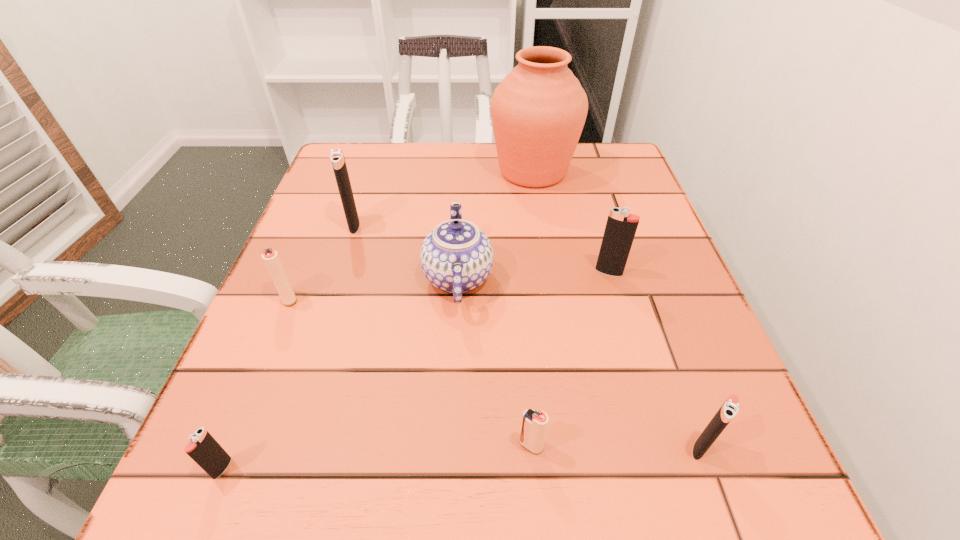
In the image, there is a desktop. Where is `vacant space at the left edge`? The image size is (960, 540). vacant space at the left edge is located at coordinates tap(247, 363).

In order to click on vacant space at the right edge in this screenshot , I will do `click(642, 208)`.

The height and width of the screenshot is (540, 960). In order to click on vacant area at the far left corner in this screenshot , I will do `click(373, 156)`.

This screenshot has width=960, height=540. What are the coordinates of `vacant space at the far right corner of the desktop` in the screenshot? It's located at coord(605,166).

The width and height of the screenshot is (960, 540). Find the location of `vacant space at the near right corner of the desktop`. vacant space at the near right corner of the desktop is located at coordinates (767, 514).

You are a GUI agent. You are given a task and a screenshot of the screen. Output one action in this format:
    pyautogui.click(x=<x>, y=<y>)
    Task: Click on the vacant area between the nearer red igniter and the leftmost black igniter
    This screenshot has width=960, height=540.
    Given the screenshot: What is the action you would take?
    pyautogui.click(x=376, y=457)

Where is `free area in between the leftmost black igniter and the second black igniter from left to right`? free area in between the leftmost black igniter and the second black igniter from left to right is located at coordinates [x=288, y=347].

At what (x,y) coordinates should I click in order to perform the action: click on free space between the right red igniter and the blue chinaware. Please return your answer as a coordinate pair (x, y). This screenshot has width=960, height=540. Looking at the image, I should click on (494, 361).

Locate an element on the screen. vacant area that lies between the farthest object and the second farthest black igniter is located at coordinates (571, 221).

Locate an element on the screen. This screenshot has width=960, height=540. free space between the third igniter from right to left and the third igniter from left to right is located at coordinates (443, 335).